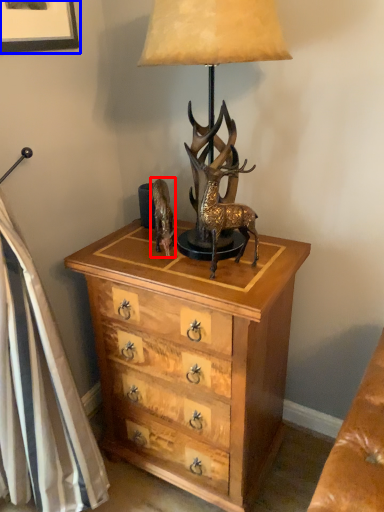
Question: Which object appears closest to the camera in this image, animal (highlighted by a red box) or picture frame (highlighted by a blue box)?

Choices:
 (A) animal
 (B) picture frame

Answer: (B)